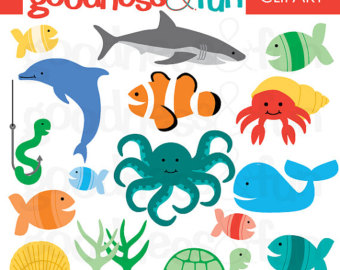
The width and height of the screenshot is (340, 270). Identify the location of hook. (40, 159).